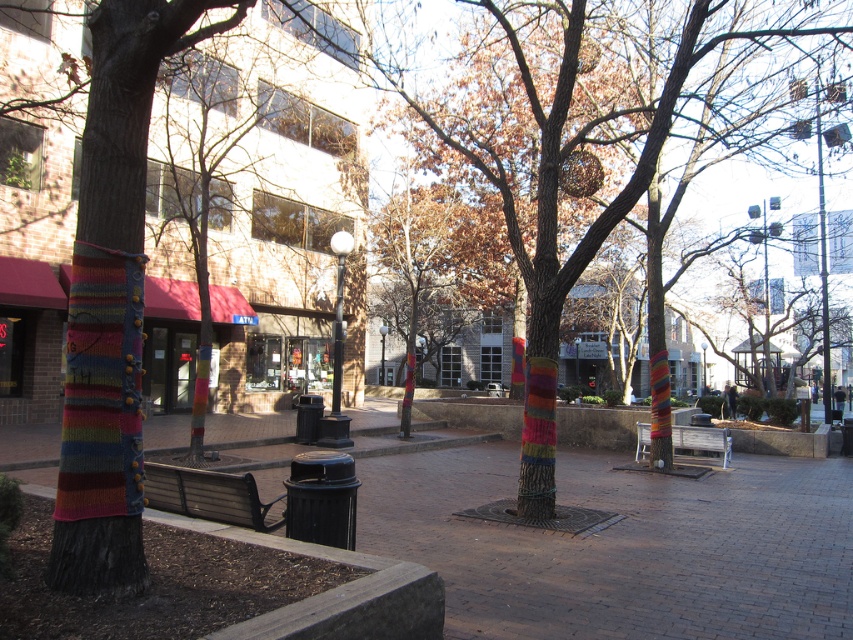
You are a photographer standing in the park and want to take a photo that includes both the brick pavement at center and the metallic gray pole at upper right. Which object will appear larger in the photo?

The brick pavement at center will appear larger in the photo because it is closer to the viewer than the metallic gray pole at upper right.

You are standing in the park and want to place a small decorative item on the closest object to you between the metallic gray pole at upper right and the wooden park bench at center. Which object should you choose?

The metallic gray pole at upper right is closer to the viewer than the wooden park bench at center, so you should place the decorative item on the metallic gray pole at upper right.